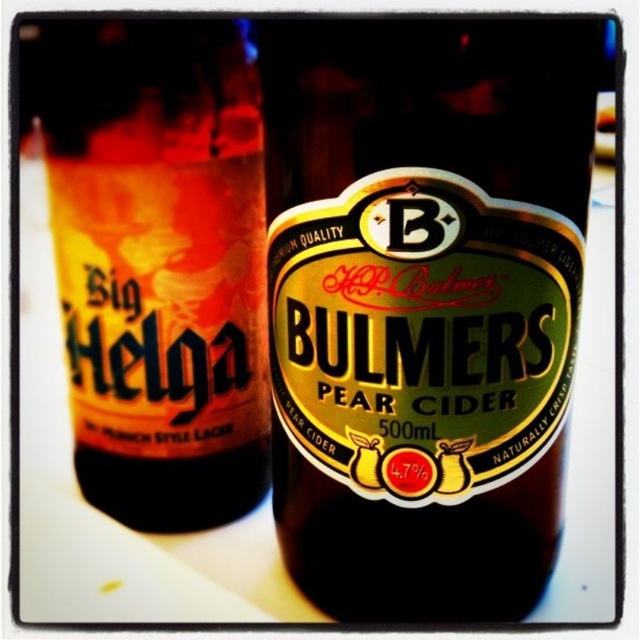
Is point (540, 164) positioned behind point (236, 102)?

No, it is not.

Where is `green glass bottle at center`? The height and width of the screenshot is (640, 640). green glass bottle at center is located at coordinates (422, 305).